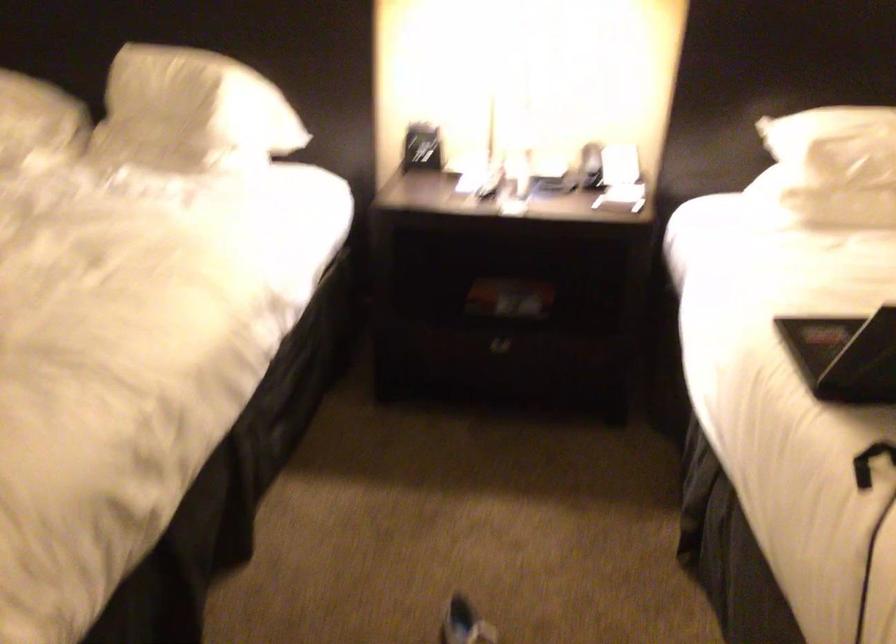
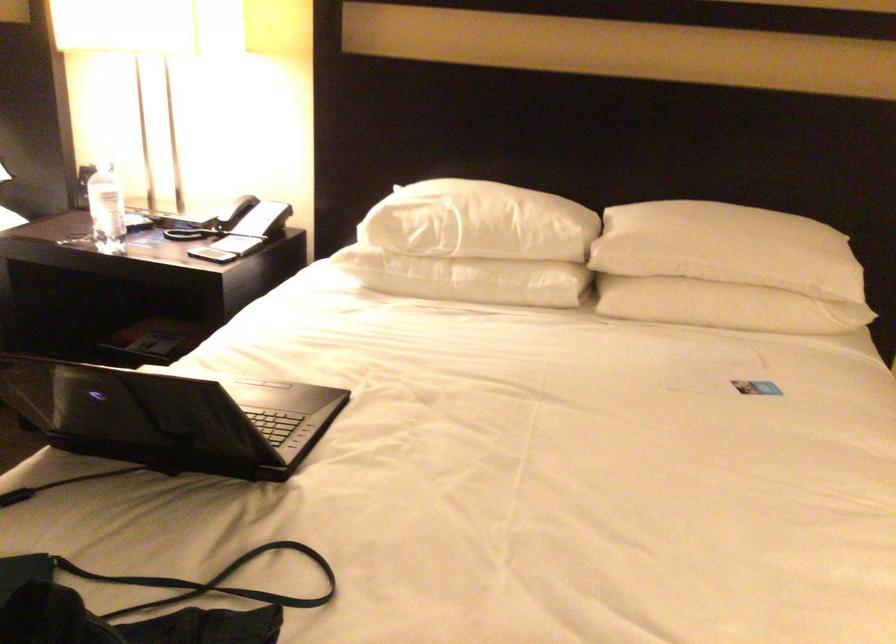
In the second image, find the point that corresponds to point (600, 162) in the first image.

(238, 221)